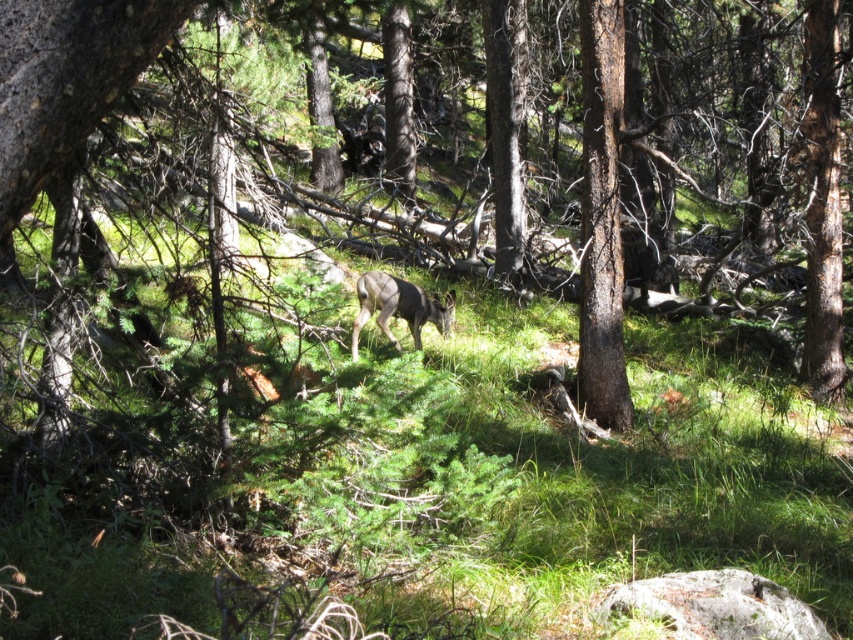
You are standing in the forest and want to take a photo of the deer. You notice two points in the scene labeled as point (616, 344) and point (438, 305). Which point is closer to you when you take the photo?

Result: Point (616, 344) is closer to the camera than point (438, 305), so it is closer to you when you take the photo.